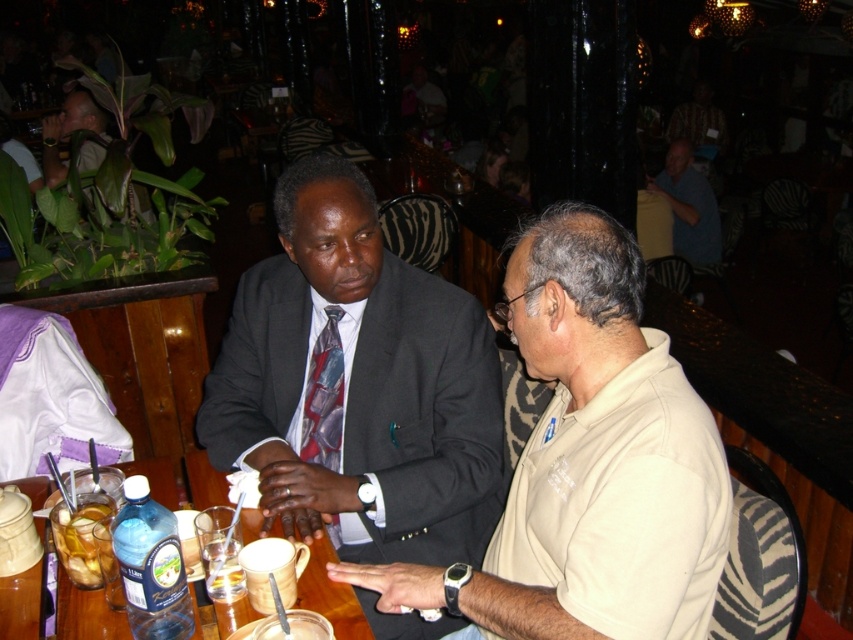
You are standing in the bar and want to find the dark gray suit at center. Based on the coordinates provided, can you confirm if the point marked at (357, 385) is where the dark gray suit at center is located?

Yes, the point marked at (357, 385) indicates the location of the dark gray suit at center as per the Objects Description provided.

You are a waiter in a restaurant and need to clear the table. You see the translucent glass cup at lower left and the translucent glass at table left. Which one should you pick up first to avoid knocking over the other?

You should pick up the translucent glass cup at lower left first because it is positioned over the translucent glass at table left, so removing the upper one first will prevent disturbing the lower glass.

You are a waiter in a restaurant. You need to place a dessert plate between the dark gray suit at center and the translucent glass cup at lower left. The plate is 10 inches in diameter. Will it fit without touching either object?

The dark gray suit at center and translucent glass cup at lower left are 21.44 inches apart from each other. The dessert plate is 10 inches in diameter, so there is enough space between them to place the plate without it touching either object.